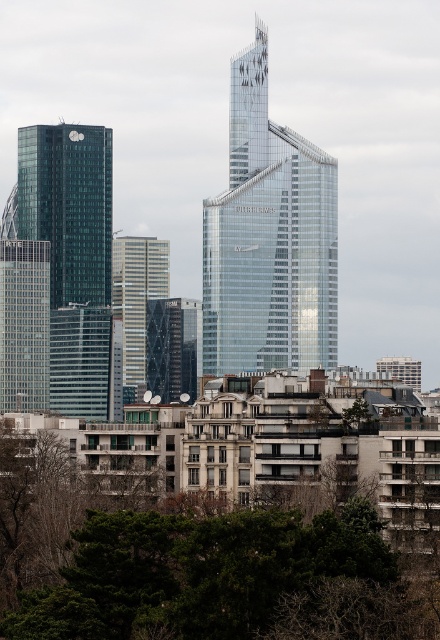
You are a drone operator tasked with delivering a package to a specific location in this city. Your GPS coordinates show that the delivery point is at point (x=201, y=566). Based on the scene description, what is the nearest landmark to this coordinate?

The point (x=201, y=566) is located on the green leafy tree at center, so the nearest landmark to this coordinate is the green leafy tree at center.

Looking at this image, you are a drone operator trying to navigate between the green leafy tree at center and the shiny glass skyscraper at left. Which object is located to the right of the other?

The green leafy tree at center is positioned on the right side of the shiny glass skyscraper at left, so the tree is to the right of the skyscraper.